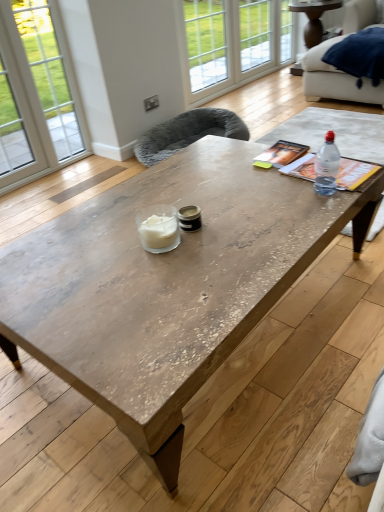
Question: Is point (264, 5) closer or farther from the camera than point (145, 146)?

Choices:
 (A) farther
 (B) closer

Answer: (A)

Question: Considering the positions of clear glass window at upper center, which ranks as the second window in right-to-left order, and soft gray fabric armchair at center, the 1th armchair viewed from the left, in the image, is clear glass window at upper center, which ranks as the second window in right-to-left order, taller or shorter than soft gray fabric armchair at center, the 1th armchair viewed from the left,?

Choices:
 (A) short
 (B) tall

Answer: (B)

Question: Which object is the closest to the clear glass window at upper center, which ranks as the third window in left-to-right order?

Choices:
 (A) soft gray fabric armchair at center, which is the 2th armchair from top to bottom
 (B) velvet blue armchair at upper right, which is the first armchair in right-to-left order
 (C) clear glass window at upper center, the 2th window from the left
 (D) rustic wood coffee table at center
 (E) clear plastic bottle at upper right

Answer: (C)

Question: Which of these objects is positioned closest to the clear glass window at upper center, the 2th window from the left?

Choices:
 (A) clear glass window at upper center, which ranks as the third window in left-to-right order
 (B) velvet blue armchair at upper right, the 2th armchair viewed from the left
 (C) clear plastic bottle at upper right
 (D) white glass door at upper center
 (E) clear glass window at upper center, the 3th window from the right

Answer: (D)